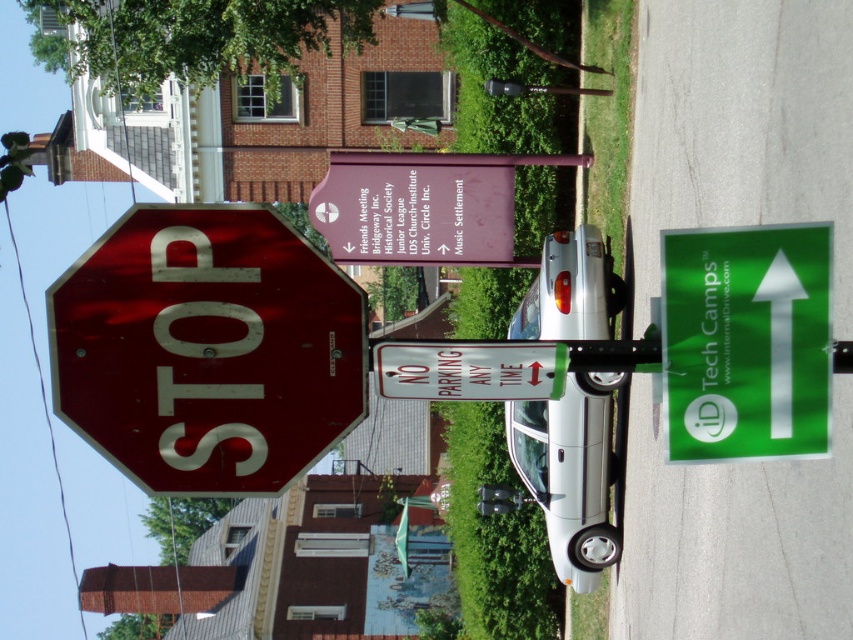
Question: Based on their relative distances, which object is farther from the shiny red stop sign at left?

Choices:
 (A) green glossy arrow at upper right
 (B) white plastic sign at center

Answer: (A)

Question: Does shiny red stop sign at left appear on the left side of white plastic sign at center?

Choices:
 (A) no
 (B) yes

Answer: (B)

Question: Is shiny red stop sign at left thinner than green glossy arrow at upper right?

Choices:
 (A) yes
 (B) no

Answer: (B)

Question: Considering the relative positions of shiny red stop sign at left and green glossy arrow at upper right in the image provided, where is shiny red stop sign at left located with respect to green glossy arrow at upper right?

Choices:
 (A) right
 (B) left

Answer: (B)

Question: Which object is positioned farthest from the green glossy arrow at upper right?

Choices:
 (A) white plastic sign at center
 (B) shiny red stop sign at left

Answer: (B)

Question: Which point is farther to the camera?

Choices:
 (A) green glossy arrow at upper right
 (B) white plastic sign at center

Answer: (A)